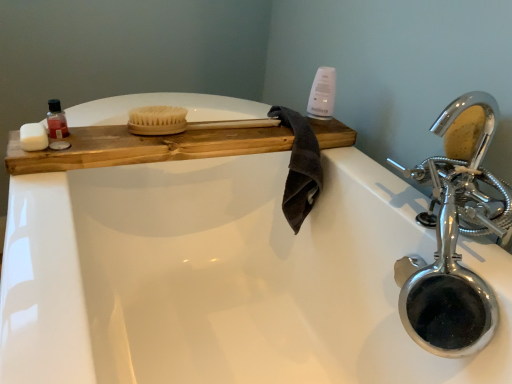
Question: Is dark brown cotton towel at center taller or shorter than natural wood brush at center?

Choices:
 (A) short
 (B) tall

Answer: (B)

Question: In the image, is dark brown cotton towel at center positioned in front of or behind natural wood brush at center?

Choices:
 (A) behind
 (B) front

Answer: (A)

Question: Based on their relative distances, which object is farther from the white matte soap at left?

Choices:
 (A) chrome metallic faucet at upper right
 (B) wooden tray at upper left
 (C) chrome/metallic faucet at right
 (D) white glossy bottle at upper right
 (E) dark brown cotton towel at center

Answer: (C)

Question: Estimate the real-world distances between objects in this image. Which object is closer to the white glossy bottle at upper right?

Choices:
 (A) chrome metallic faucet at upper right
 (B) natural wood brush at center
 (C) white matte soap at left
 (D) wooden tray at upper left
 (E) chrome/metallic faucet at right

Answer: (B)